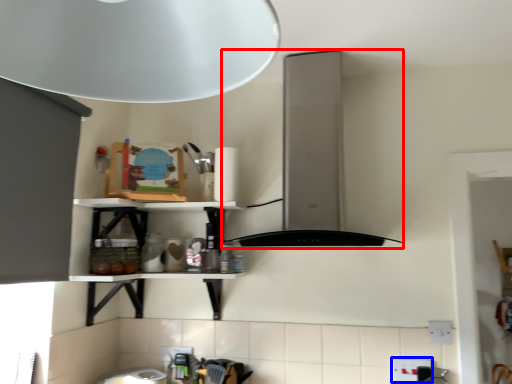
Question: Which point is closer to the camera, vent (highlighted by a red box) or electric outlet (highlighted by a blue box)?

Choices:
 (A) vent
 (B) electric outlet

Answer: (A)